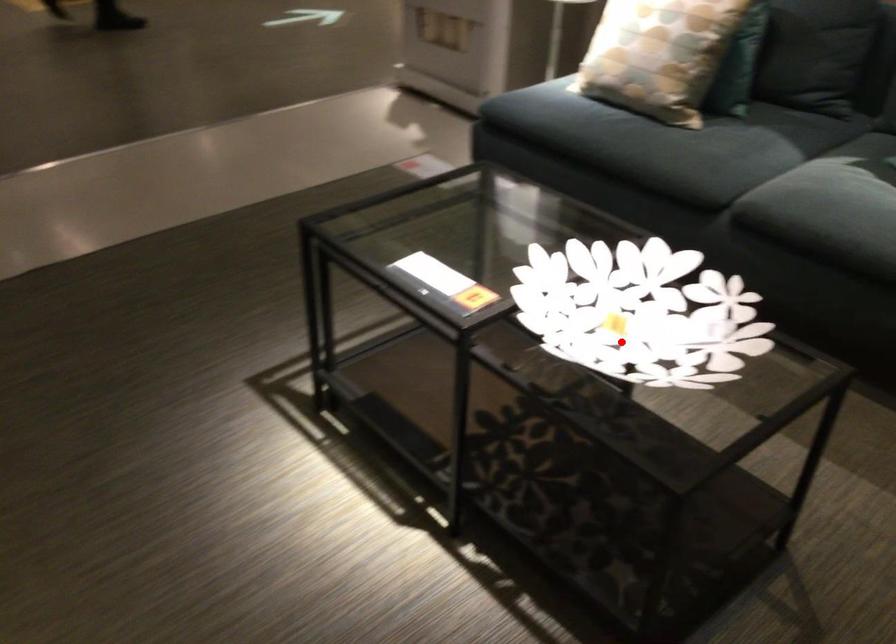
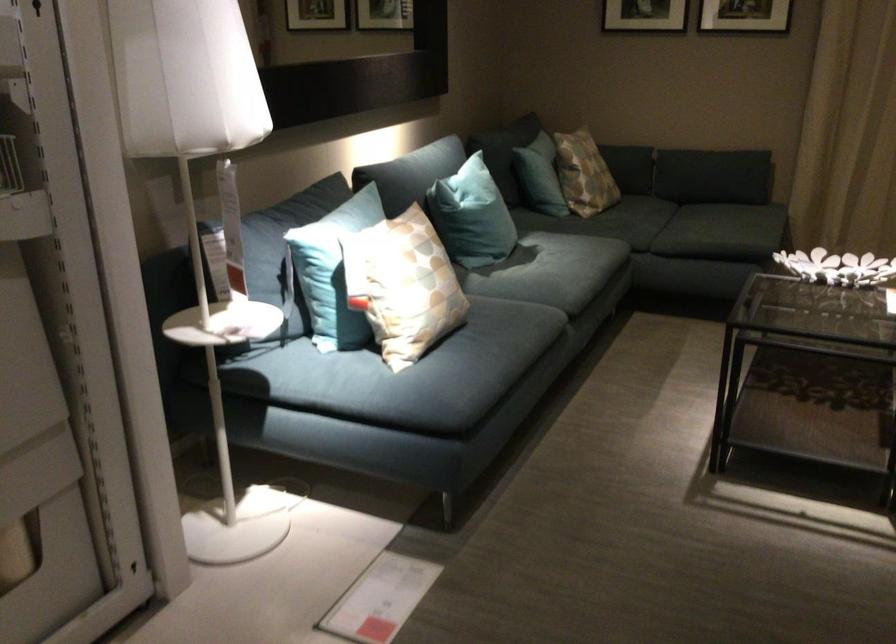
Question: A red point is marked in image1. In image2, is the corresponding 3D point closer to the camera or farther? Reply with the corresponding letter.

Choices:
 (A) The corresponding 3D point is closer.
 (B) The corresponding 3D point is farther.

Answer: (B)